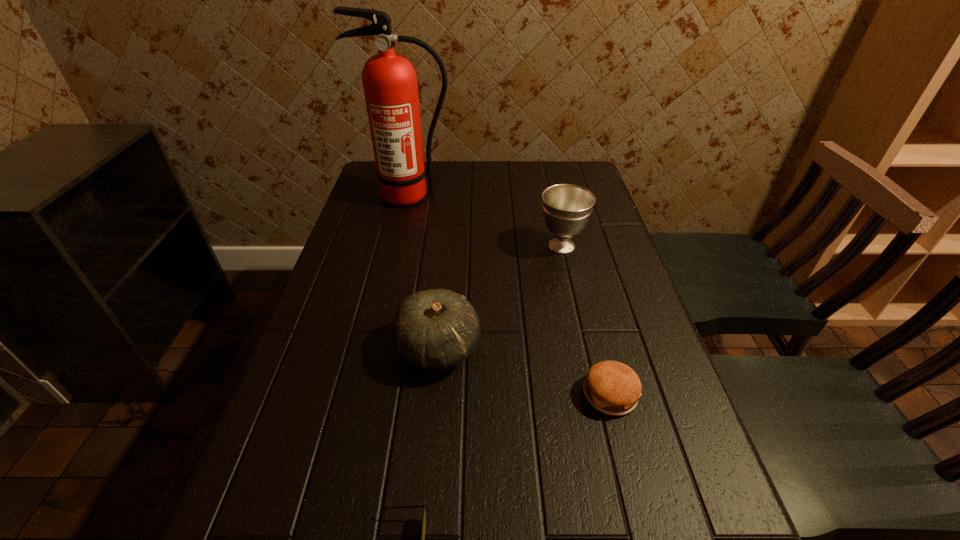
Locate an element on the screen. the farthest object is located at coordinates (389, 80).

Image resolution: width=960 pixels, height=540 pixels. Identify the location of fire extinguisher. (389, 80).

Image resolution: width=960 pixels, height=540 pixels. In order to click on chalice in this screenshot , I will do `click(566, 208)`.

This screenshot has height=540, width=960. I want to click on gourd, so 437,329.

Identify the location of the fourth tallest object. (612, 387).

Find the location of a particular element. Image resolution: width=960 pixels, height=540 pixels. vacant space positioned on the handle side of the farthest object is located at coordinates 392,276.

I want to click on vacant region located on the front of the chalice, so click(592, 378).

Where is `free region located 0.180m on the right of the gourd`? The height and width of the screenshot is (540, 960). free region located 0.180m on the right of the gourd is located at coordinates (564, 348).

Where is `free space located 0.400m on the back of the second shortest object`? The image size is (960, 540). free space located 0.400m on the back of the second shortest object is located at coordinates (573, 253).

Find the location of a particular element. object at the far edge is located at coordinates (389, 80).